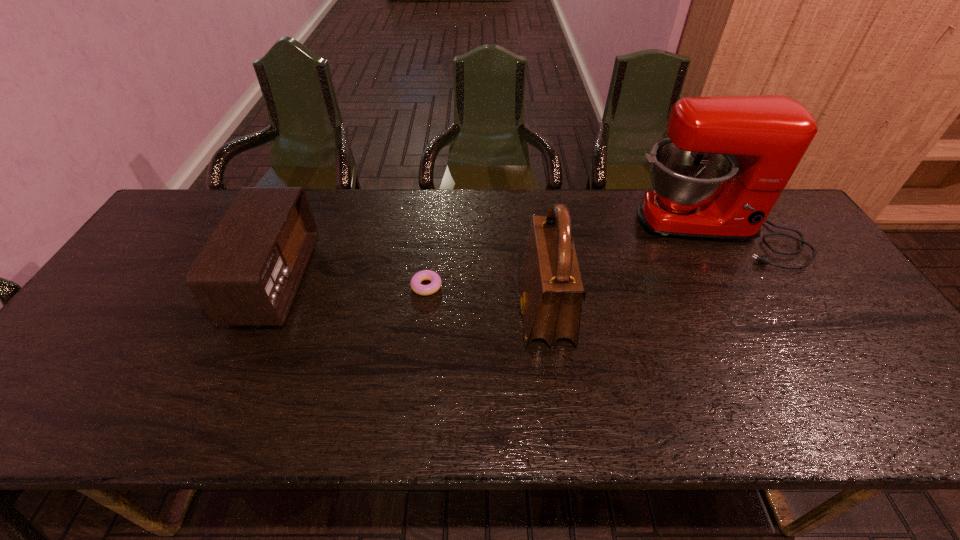
The width and height of the screenshot is (960, 540). Identify the location of free space located 0.140m on the front flap of the shoulder bag. (465, 312).

The height and width of the screenshot is (540, 960). What are the coordinates of `vacant space positioned 0.090m on the front flap of the shoulder bag` in the screenshot? It's located at (484, 312).

Identify the location of free space located 0.060m on the front-facing side of the leftmost object. The height and width of the screenshot is (540, 960). (326, 281).

What are the coordinates of `free location located 0.370m on the back of the doughnut` in the screenshot? It's located at (437, 196).

Find the location of a particular element. The height and width of the screenshot is (540, 960). object present at the far edge is located at coordinates (727, 160).

Locate an element on the screen. The height and width of the screenshot is (540, 960). object located at the right edge is located at coordinates (727, 160).

Where is `object at the far right corner`? The width and height of the screenshot is (960, 540). object at the far right corner is located at coordinates (727, 160).

Find the location of a particular element. The width and height of the screenshot is (960, 540). vacant region at the far edge of the desktop is located at coordinates (639, 235).

Where is `free region at the near edge of the desktop`? The image size is (960, 540). free region at the near edge of the desktop is located at coordinates (176, 422).

In order to click on free space at the right edge of the desktop in this screenshot , I will do `click(850, 312)`.